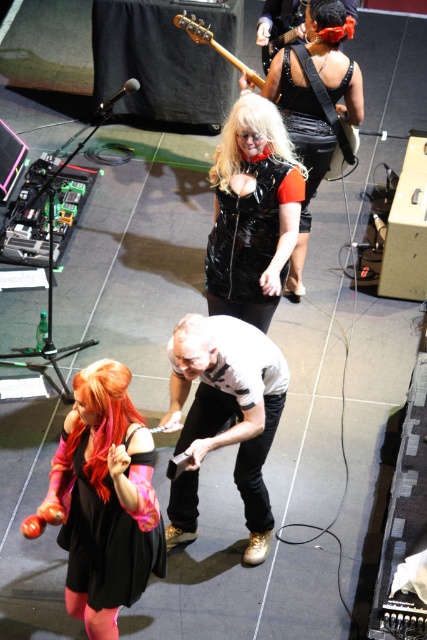
You are an event photographer positioned at the back of the stage. You need to capture a clear photo of the blondehair at center without the vivid orange hair at lower left blocking the view. Is this possible?

The vivid orange hair at lower left is in front of blondehair at center, so it will block the view. Move to the side to get an unobstructed angle.

You are a stagehand preparing to place a 1.2 meter wide backdrop between the shiny black vest at center and the vivid orange hair at lower left. Based on their widths, will the backdrop fit without overlapping either?

The shiny black vest at center might be wider than vivid orange hair at lower left, so the 1.2 meter backdrop may not fit properly between them without overlapping since the combined width of the two objects could exceed the backdrop size.